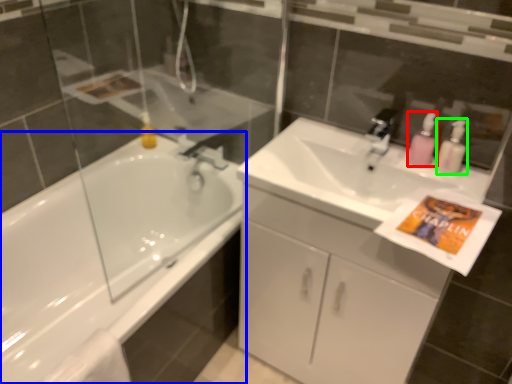
Question: Which object is the farthest from soap dispenser (highlighted by a red box)? Choose among these: bathtub (highlighted by a blue box) or cleaning product (highlighted by a green box).

Choices:
 (A) bathtub
 (B) cleaning product

Answer: (A)